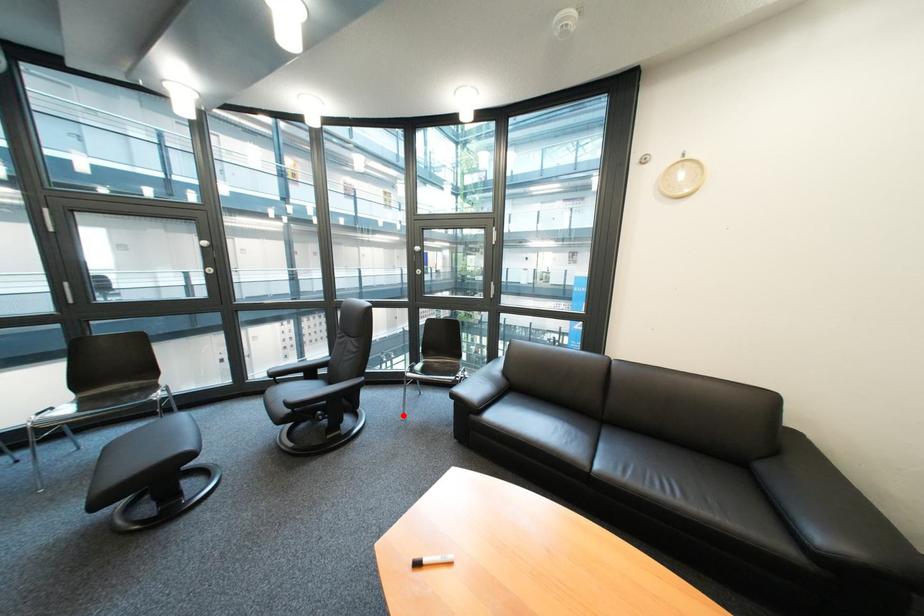
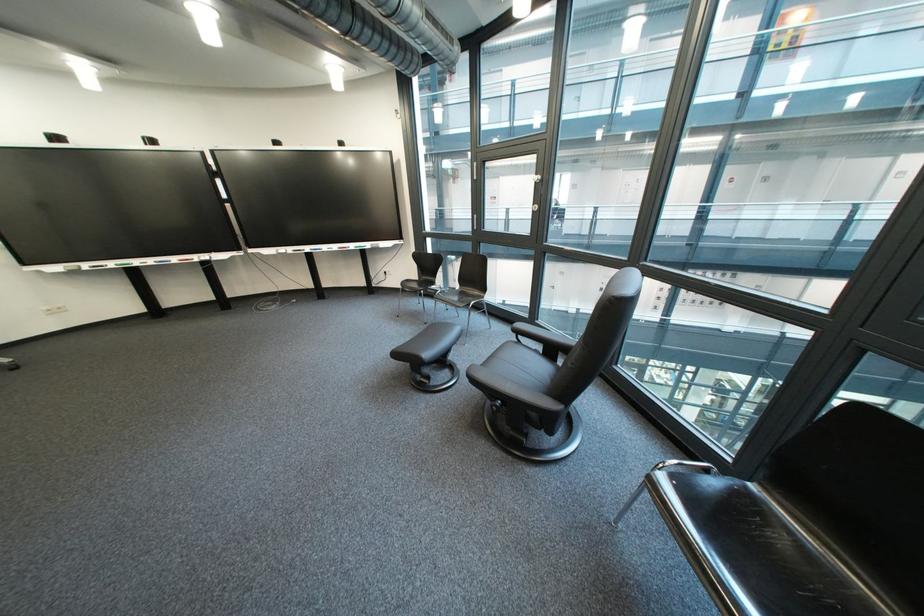
Question: I am providing you with two images of the same scene from different viewpoints. Given a red point in image1, look at the same physical point in image2. Is it:

Choices:
 (A) Closer to the viewpoint
 (B) Farther from the viewpoint

Answer: (A)